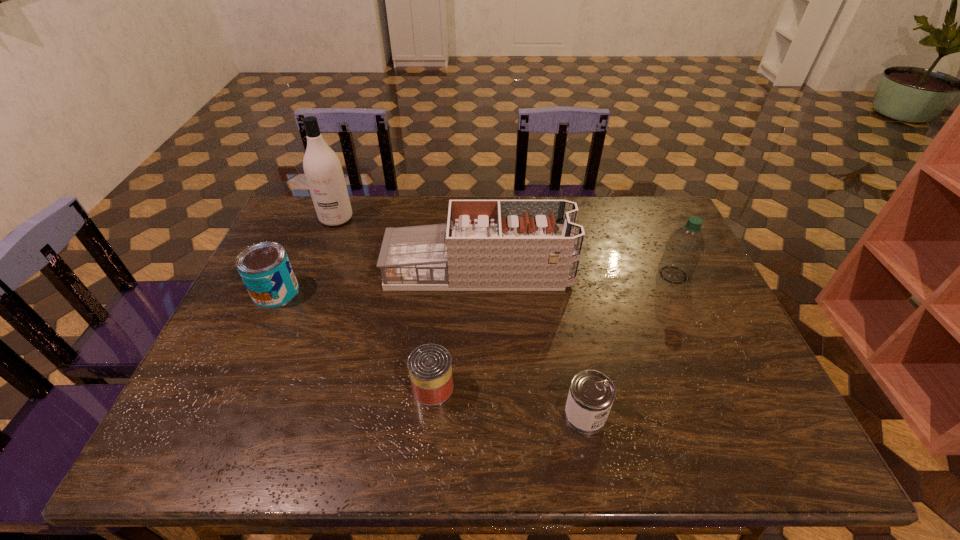
At what (x,y) coordinates should I click in order to perform the action: click on the farthest object. Please return your answer as a coordinate pair (x, y). This screenshot has height=540, width=960. Looking at the image, I should click on (323, 171).

Identify the location of shampoo. Image resolution: width=960 pixels, height=540 pixels. (323, 171).

Locate an element on the screen. Image resolution: width=960 pixels, height=540 pixels. the rightmost object is located at coordinates (684, 248).

Locate an element on the screen. dollhouse is located at coordinates (486, 245).

Where is `the fourth tallest object`? This screenshot has width=960, height=540. the fourth tallest object is located at coordinates (265, 269).

The height and width of the screenshot is (540, 960). I want to click on the tallest can, so click(x=265, y=269).

The height and width of the screenshot is (540, 960). What are the coordinates of `the rightmost can` in the screenshot? It's located at (591, 395).

I want to click on the second can from left to right, so click(x=429, y=365).

The width and height of the screenshot is (960, 540). I want to click on free space located 0.060m on the front-facing side of the shampoo, so click(x=327, y=240).

The width and height of the screenshot is (960, 540). What are the coordinates of `free space located 0.350m on the front of the water bottle` in the screenshot? It's located at (728, 395).